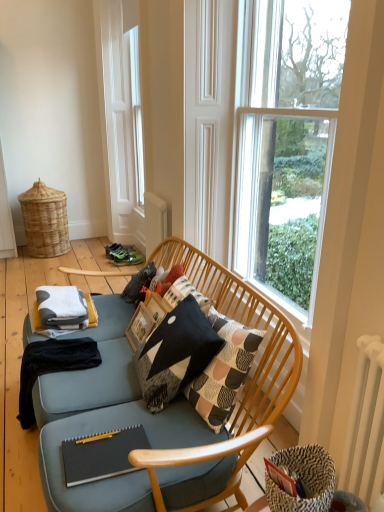
Identify the location of black matte notebook at lower center. (101, 454).

What do you see at coordinates (51, 367) in the screenshot? I see `black cotton blanket at lower left` at bounding box center [51, 367].

Image resolution: width=384 pixels, height=512 pixels. What are the coordinates of `black textured throw pillow at center` in the screenshot? It's located at (175, 353).

In order to click on woven natural basket at left in this screenshot , I will do `click(45, 220)`.

Considering the relative sizes of patterned woven basket at lower right and white metallic radiator at right in the image provided, is patterned woven basket at lower right taller than white metallic radiator at right?

In fact, patterned woven basket at lower right may be shorter than white metallic radiator at right.

Which object is thinner, patterned woven basket at lower right or white metallic radiator at right?

white metallic radiator at right.

Is point (296, 503) closer or farther from the camera than point (378, 403)?

Point (296, 503).

Is there a large distance between patterned woven basket at lower right and white metallic radiator at right?

They are positioned close to each other.

What's the angular difference between black textured throw pillow at center and white metallic radiator at right's facing directions?

The angle between the facing direction of black textured throw pillow at center and the facing direction of white metallic radiator at right is 1.29 degrees.

Considering the relative positions of black textured throw pillow at center and white metallic radiator at right in the image provided, is black textured throw pillow at center to the left of white metallic radiator at right from the viewer's perspective?

Correct, you'll find black textured throw pillow at center to the left of white metallic radiator at right.

From a real-world perspective, which is physically below, black textured throw pillow at center or white metallic radiator at right?

black textured throw pillow at center is physically lower.

Is woven natural basket at left in front of black cotton blanket at lower left?

No, the depth of woven natural basket at left is greater than that of black cotton blanket at lower left.

Which of these two, woven natural basket at left or black cotton blanket at lower left, stands taller?

Standing taller between the two is woven natural basket at left.

From a real-world perspective, which is physically above, woven natural basket at left or black cotton blanket at lower left?

woven natural basket at left, from a real-world perspective.

Considering the relative sizes of clear glass window at upper right and black matte notebook at lower center in the image provided, is clear glass window at upper right shorter than black matte notebook at lower center?

In fact, clear glass window at upper right may be taller than black matte notebook at lower center.

Would you say clear glass window at upper right is a long distance from black matte notebook at lower center?

clear glass window at upper right is positioned a significant distance from black matte notebook at lower center.

Could you tell me if clear glass window at upper right is facing black matte notebook at lower center?

Yes, clear glass window at upper right is turned towards black matte notebook at lower center.

From a real-world perspective, relative to black matte notebook at lower center, is clear glass window at upper right vertically above or below?

In terms of real-world spatial position, clear glass window at upper right is above black matte notebook at lower center.

Which is behind, point (52, 238) or point (348, 430)?

The point (52, 238) is farther from the camera.

Looking at this image, is woven natural basket at left to the left of white metallic radiator at right from the viewer's perspective?

Yes.

Is woven natural basket at left far from white metallic radiator at right?

woven natural basket at left is far away from white metallic radiator at right.

Which object is closer to the camera taking this photo, patterned woven basket at lower right or black matte notebook at lower center?

patterned woven basket at lower right is in front.

Is patterned woven basket at lower right positioned with its back to black matte notebook at lower center?

No, black matte notebook at lower center is not at the back of patterned woven basket at lower right.

Which object is wider, patterned woven basket at lower right or black matte notebook at lower center?

Wider between the two is black matte notebook at lower center.

Does patterned woven basket at lower right have a lesser height compared to black matte notebook at lower center?

No, patterned woven basket at lower right is not shorter than black matte notebook at lower center.

Would you say black matte notebook at lower center is to the left or to the right of white cotton blanket at lower left in the picture?

black matte notebook at lower center is to the right of white cotton blanket at lower left.

From the image's perspective, relative to white cotton blanket at lower left, is black matte notebook at lower center above or below?

Based on their image positions, black matte notebook at lower center is located beneath white cotton blanket at lower left.

Is the surface of black matte notebook at lower center in direct contact with white cotton blanket at lower left?

No, black matte notebook at lower center is not touching white cotton blanket at lower left.

Who is taller, black matte notebook at lower center or white cotton blanket at lower left?

Standing taller between the two is white cotton blanket at lower left.

Where is `swivel chair below the white metallic radiator at right (from the image's perspective)`? swivel chair below the white metallic radiator at right (from the image's perspective) is located at coordinates (308, 482).

Where is `radiator positioned vertically above the black textured throw pillow at center (from a real-world perspective)`? The image size is (384, 512). radiator positioned vertically above the black textured throw pillow at center (from a real-world perspective) is located at coordinates (366, 425).

When comparing their distances from white metallic radiator at right, does black matte notebook at lower center or black textured throw pillow at center seem further?

black matte notebook at lower center lies further to white metallic radiator at right than the other object.

When comparing their distances from white cotton blanket at lower left, does white metallic radiator at right or woven natural basket at left seem closer?

Among the two, white metallic radiator at right is located nearer to white cotton blanket at lower left.

Looking at this image, based on their spatial positions, is black cotton blanket at lower left or woven natural basket at left closer to white cotton blanket at lower left?

black cotton blanket at lower left.

Based on their spatial positions, is clear glass window at upper right or patterned woven basket at lower right closer to white metallic radiator at right?

Among the two, patterned woven basket at lower right is located nearer to white metallic radiator at right.

Estimate the real-world distances between objects in this image. Which object is closer to clear glass window at upper right, black cotton blanket at lower left or black textured throw pillow at center?

black textured throw pillow at center.

Estimate the real-world distances between objects in this image. Which object is closer to white cotton blanket at lower left, black matte notebook at lower center or black cotton blanket at lower left?

black cotton blanket at lower left is positioned closer to the anchor white cotton blanket at lower left.

Considering their positions, is black cotton blanket at lower left positioned further to clear glass window at upper right than white metallic radiator at right?

Among the two, black cotton blanket at lower left is located further to clear glass window at upper right.

Estimate the real-world distances between objects in this image. Which object is closer to clear glass window at upper right, white cotton blanket at lower left or patterned woven basket at lower right?

The object closer to clear glass window at upper right is patterned woven basket at lower right.

Identify the location of throw pillow between clear glass window at upper right and patterned woven basket at lower right from top to bottom. pos(175,353).

This screenshot has width=384, height=512. Find the location of `blanket between clear glass window at upper right and woven natural basket at left along the z-axis`. blanket between clear glass window at upper right and woven natural basket at left along the z-axis is located at coordinates (51, 367).

You are a GUI agent. You are given a task and a screenshot of the screen. Output one action in this format:
    pyautogui.click(x=<x>, y=<y>)
    Task: Click on the radiator between patterned woven basket at lower right and white cotton blanket at lower left in the front-back direction
    This screenshot has width=384, height=512.
    Given the screenshot: What is the action you would take?
    pyautogui.click(x=366, y=425)

At what (x,y) coordinates should I click in order to perform the action: click on throw pillow located between clear glass window at upper right and woven natural basket at left in the depth direction. Please return your answer as a coordinate pair (x, y). Looking at the image, I should click on (175, 353).